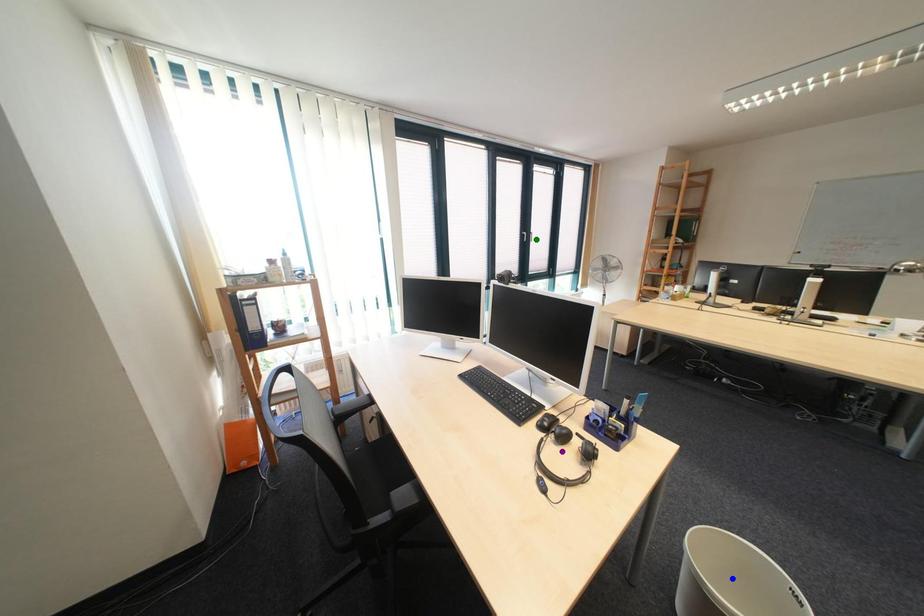
Order these from farthest to nearest:
purple point
blue point
green point

1. green point
2. purple point
3. blue point